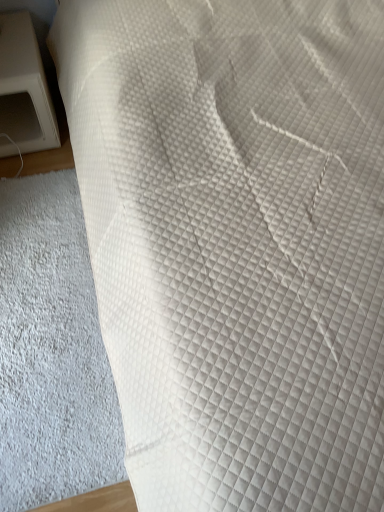
Where is `white quilted fabric at lower left`? white quilted fabric at lower left is located at coordinates (51, 351).

What do you see at coordinates (51, 351) in the screenshot? The width and height of the screenshot is (384, 512). I see `white quilted fabric at lower left` at bounding box center [51, 351].

Describe the element at coordinates (24, 90) in the screenshot. I see `white plastic microwave at left` at that location.

This screenshot has height=512, width=384. I want to click on white plastic microwave at left, so click(x=24, y=90).

Image resolution: width=384 pixels, height=512 pixels. Find the location of `white quilted fabric at lower left`. white quilted fabric at lower left is located at coordinates (51, 351).

Is white quilted fabric at lower left at the right side of white plastic microwave at left?

Yes.

Which object is further away from the camera taking this photo, white quilted fabric at lower left or white plastic microwave at left?

white plastic microwave at left.

Is point (18, 252) closer or farther from the camera than point (19, 36)?

Point (18, 252) appears to be closer to the viewer than point (19, 36).

From the image's perspective, between white quilted fabric at lower left and white plastic microwave at left, who is located below?

white quilted fabric at lower left appears lower in the image.

From a real-world perspective, relative to white plastic microwave at left, is white quilted fabric at lower left vertically above or below?

white quilted fabric at lower left is situated lower than white plastic microwave at left in the real world.

Considering the sizes of white quilted fabric at lower left and white plastic microwave at left in the image, is white quilted fabric at lower left wider or thinner than white plastic microwave at left?

white quilted fabric at lower left is wider than white plastic microwave at left.

Can you confirm if white quilted fabric at lower left is shorter than white plastic microwave at left?

Correct, white quilted fabric at lower left is not as tall as white plastic microwave at left.

Which of these two, white quilted fabric at lower left or white plastic microwave at left, is smaller?

Smaller between the two is white quilted fabric at lower left.

Can white plastic microwave at left be found inside white quilted fabric at lower left?

No, white quilted fabric at lower left does not contain white plastic microwave at left.

Would you say white quilted fabric at lower left is a long distance from white plastic microwave at left?

A: No.

Is white quilted fabric at lower left looking in the opposite direction of white plastic microwave at left?

Yes, white quilted fabric at lower left's orientation is away from white plastic microwave at left.

Can you tell me how much white quilted fabric at lower left and white plastic microwave at left differ in facing direction?

2.08 degrees.

Locate an element on the screen. Image resolution: width=384 pixels, height=512 pixels. sheet below the white plastic microwave at left (from the image's perspective) is located at coordinates (51, 351).

Considering the positions of objects white plastic microwave at left and white quilted fabric at lower left in the image provided, who is more to the left, white plastic microwave at left or white quilted fabric at lower left?

white plastic microwave at left.

From the picture: Which object is further away from the camera, white plastic microwave at left or white quilted fabric at lower left?

white plastic microwave at left is further away from the camera.

Does point (28, 86) appear closer or farther from the camera than point (26, 182)?

Point (28, 86).

From the image's perspective, is white plastic microwave at left located above or below white quilted fabric at lower left?

Based on their image positions, white plastic microwave at left is located above white quilted fabric at lower left.

From a real-world perspective, relative to white quilted fabric at lower left, is white plastic microwave at left vertically above or below?

From a real-world perspective, white plastic microwave at left is physically above white quilted fabric at lower left.

Considering the sizes of objects white plastic microwave at left and white quilted fabric at lower left in the image provided, who is wider, white plastic microwave at left or white quilted fabric at lower left?

white quilted fabric at lower left.

Can you confirm if white plastic microwave at left is shorter than white quilted fabric at lower left?

In fact, white plastic microwave at left may be taller than white quilted fabric at lower left.

Who is smaller, white plastic microwave at left or white quilted fabric at lower left?

white quilted fabric at lower left is smaller.

Is white quilted fabric at lower left inside white plastic microwave at left?

No, white quilted fabric at lower left is located outside of white plastic microwave at left.

Is white plastic microwave at left not close to white quilted fabric at lower left?

Actually, white plastic microwave at left and white quilted fabric at lower left are a little close together.

Is white plastic microwave at left positioned with its back to white quilted fabric at lower left?

No, white quilted fabric at lower left is not at the back of white plastic microwave at left.

How different are the orientations of white plastic microwave at left and white quilted fabric at lower left in degrees?

The facing directions of white plastic microwave at left and white quilted fabric at lower left are 2.08 degrees apart.

Measure the distance between white plastic microwave at left and white quilted fabric at lower left.

white plastic microwave at left is 53.39 centimeters from white quilted fabric at lower left.

Locate an element on the screen. furniture lying behind the white quilted fabric at lower left is located at coordinates (24, 90).

Identify the location of sheet that appears below the white plastic microwave at left (from a real-world perspective). (51, 351).

Image resolution: width=384 pixels, height=512 pixels. Find the location of `furniture on the left of white quilted fabric at lower left`. furniture on the left of white quilted fabric at lower left is located at coordinates (24, 90).